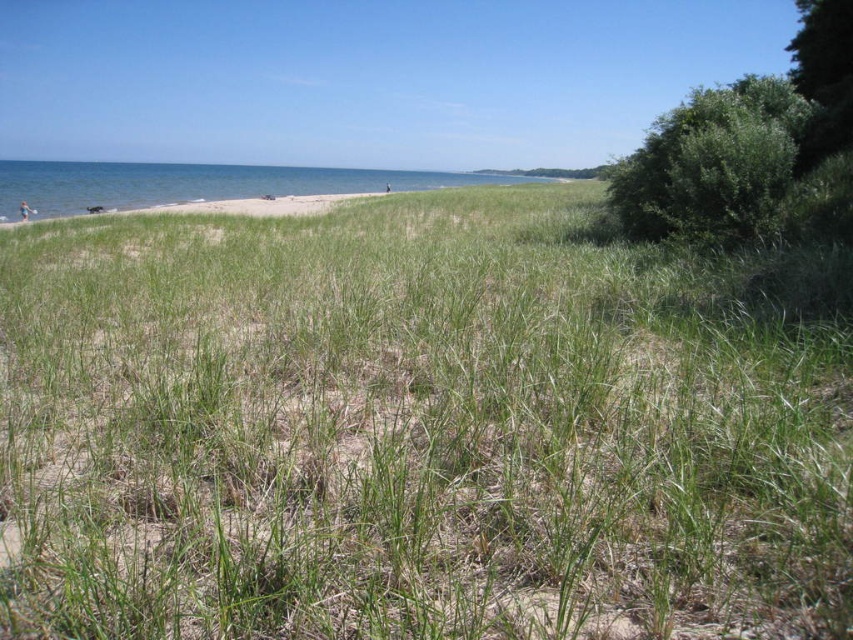
Identify the location of green grassy at center. (410, 432).

Is green grassy at center smaller than blue water at upper left?

Yes, green grassy at center is smaller than blue water at upper left.

Is point (253, 275) more distant than point (74, 179)?

No, it is not.

You are a GUI agent. You are given a task and a screenshot of the screen. Output one action in this format:
    pyautogui.click(x=<x>, y=<y>)
    Task: Click on the green grassy at center
    This screenshot has height=640, width=853.
    Given the screenshot: What is the action you would take?
    (410, 432)